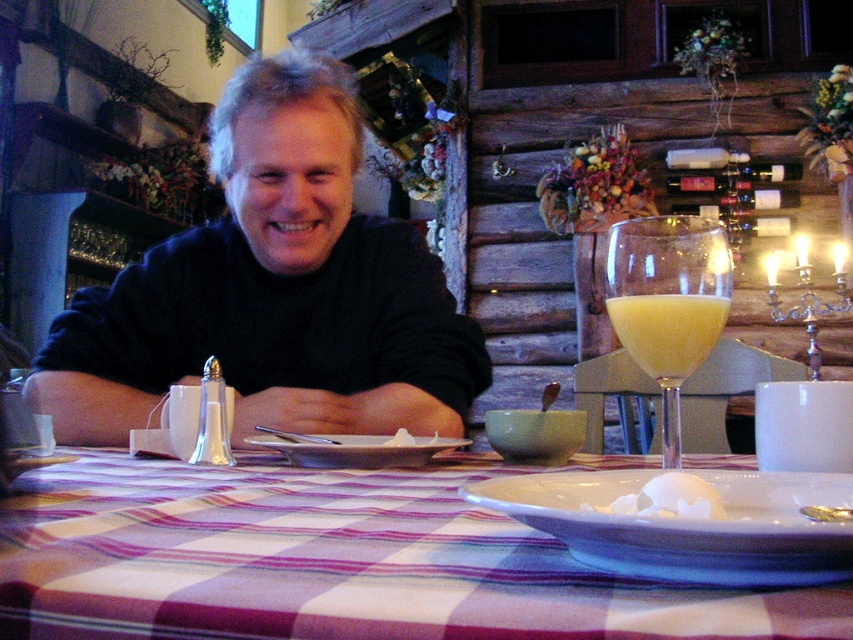
You are a waiter in a rustic restaurant. You need to place a new menu on the table without covering the yellow frothy liquid at center and the yellow translucent wine glass at right. Where should you place the menu so it doesn,t cover them?

The yellow translucent wine glass at right is much taller than the yellow frothy liquid at center, so placing the menu between them or behind the taller glass would prevent it from covering both items.

You are a server in a rustic restaurant and need to place a 12 inch long dessert plate between the black matte sweater at center and the glass of yellowish beverage in the foreground. Can you fit it there?

The distance between the black matte sweater at center and the glass of yellowish beverage in the foreground is 35.14 inches. Since the dessert plate is only 12 inches long, there is more than enough space to place it between them.